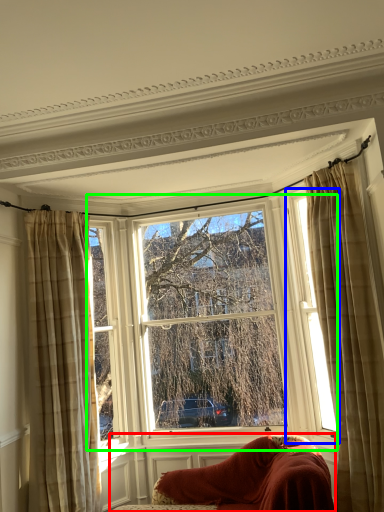
Question: Which object is positioned closest to furniture (highlighted by a red box)? Select from window (highlighted by a blue box) and window (highlighted by a green box).

Choices:
 (A) window
 (B) window

Answer: (B)